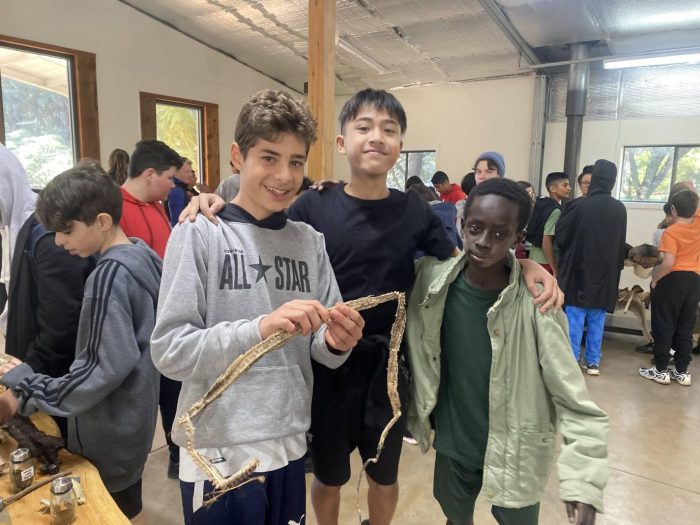
Identify the location of floor. (642, 455).